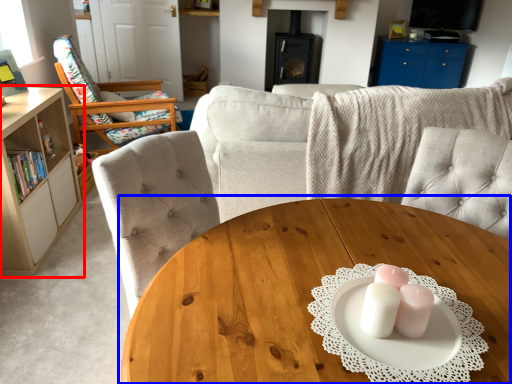
Question: Which object is further to the camera taking this photo, cabinetry (highlighted by a red box) or coffee table (highlighted by a blue box)?

Choices:
 (A) cabinetry
 (B) coffee table

Answer: (A)